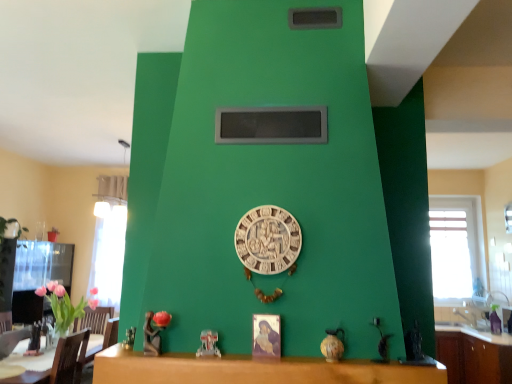
Question: In the image, is brown leather armchair at lower left positioned in front of or behind brown wood cabinet at lower right?

Choices:
 (A) behind
 (B) front

Answer: (B)

Question: From a real-world perspective, is brown leather armchair at lower left physically located above or below brown wood cabinet at lower right?

Choices:
 (A) below
 (B) above

Answer: (B)

Question: Which is nearer to the transparent glass window at right, which is the 2th window from left to right?

Choices:
 (A) wooden table at center
 (B) white glass window at left, arranged as the first window when viewed from the left
 (C) white carved clock at center
 (D) brown leather armchair at lower left
 (E) black matte window screen at upper center

Answer: (B)

Question: Estimate the real-world distances between objects in this image. Which object is closer to the white glass window at left, placed as the second window when sorted from right to left?

Choices:
 (A) transparent glass window at right, which is the 2th window from left to right
 (B) brown leather armchair at lower left
 (C) white carved clock at center
 (D) wooden table at center
 (E) black matte window screen at upper center

Answer: (B)